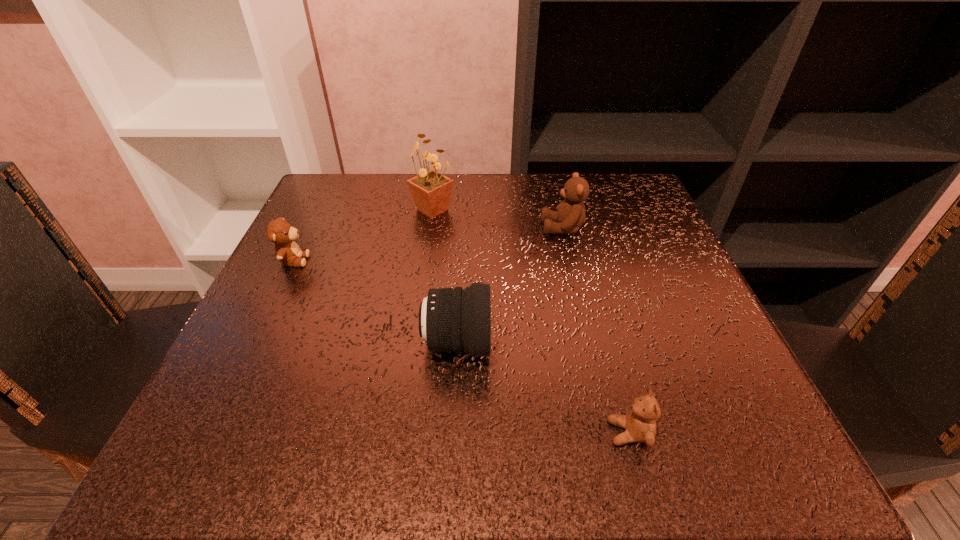
Where is `object present at the near right corner`? The height and width of the screenshot is (540, 960). object present at the near right corner is located at coordinates (640, 424).

In the image, there is a desktop. In order to click on vacant space at the far edge in this screenshot , I will do `click(485, 202)`.

Locate an element on the screen. vacant space at the near edge of the desktop is located at coordinates (327, 472).

Locate an element on the screen. The height and width of the screenshot is (540, 960). vacant space at the left edge of the desktop is located at coordinates (339, 341).

This screenshot has width=960, height=540. In the image, there is a desktop. Find the location of `vacant space at the right edge`. vacant space at the right edge is located at coordinates (656, 324).

Find the location of a particular element. This screenshot has width=960, height=540. free space at the far left corner is located at coordinates (362, 187).

The height and width of the screenshot is (540, 960). Find the location of `vacant space at the far right corner of the desktop`. vacant space at the far right corner of the desktop is located at coordinates 654,220.

In the image, there is a desktop. Find the location of `vacant region at the near right corner`. vacant region at the near right corner is located at coordinates (768, 428).

In order to click on empty space that is in between the tallest teddy bear and the telephoto lens in this screenshot , I will do `click(510, 286)`.

You are a GUI agent. You are given a task and a screenshot of the screen. Output one action in this format:
    pyautogui.click(x=<x>, y=<y>)
    Task: Click on the free space between the fourth farthest object and the tallest teddy bear
    The height and width of the screenshot is (540, 960).
    Given the screenshot: What is the action you would take?
    pyautogui.click(x=510, y=286)